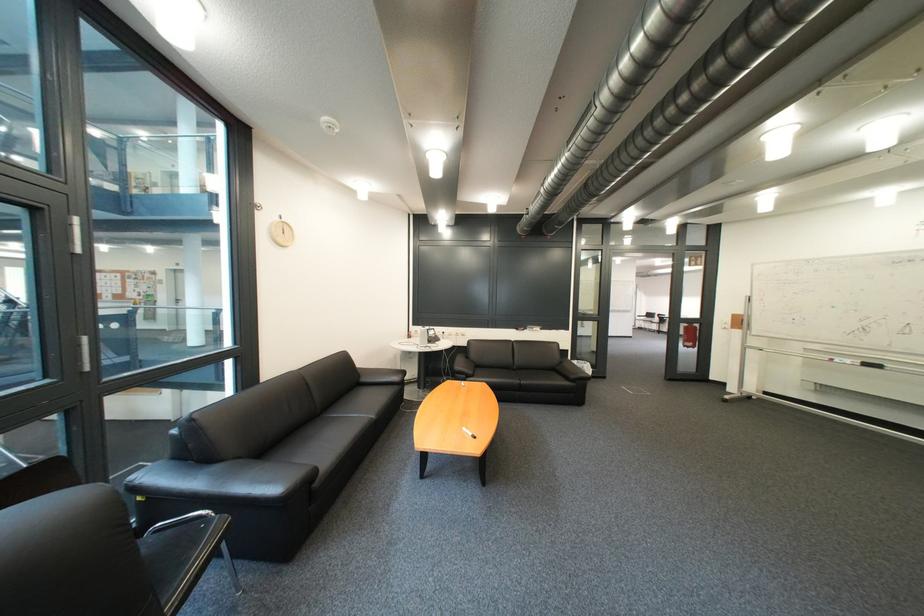
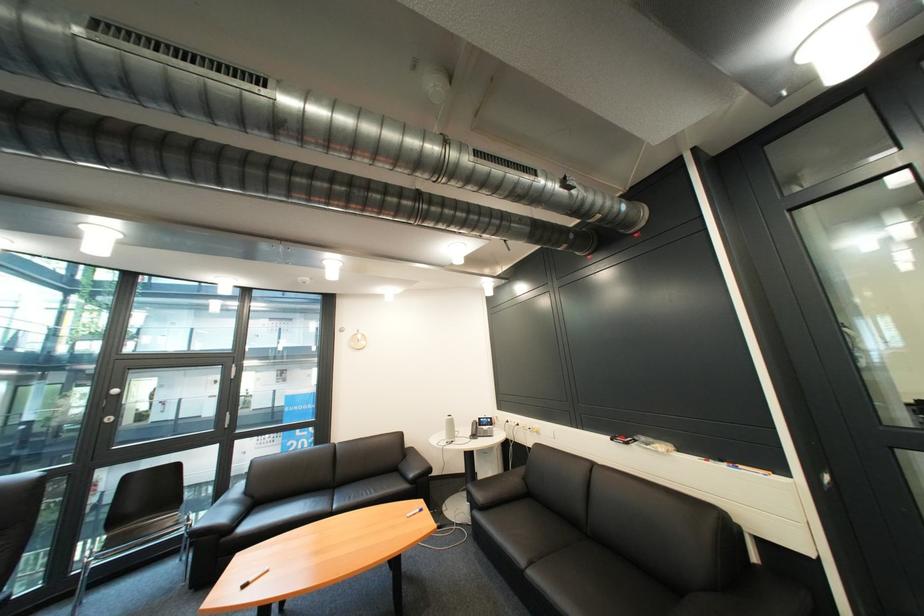
In the second image, find the point that corresponds to point (568, 333) in the first image.

(736, 468)